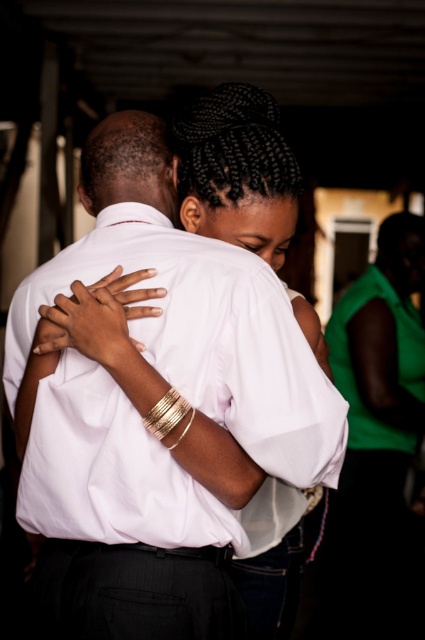
Between point (96, 346) and point (410, 385), which one is positioned behind?

The point (410, 385) is more distant.

Is point (244, 330) positioned before point (384, 227)?

That is True.

What are the coordinates of `white smooth shirt at center` in the screenshot? It's located at (155, 410).